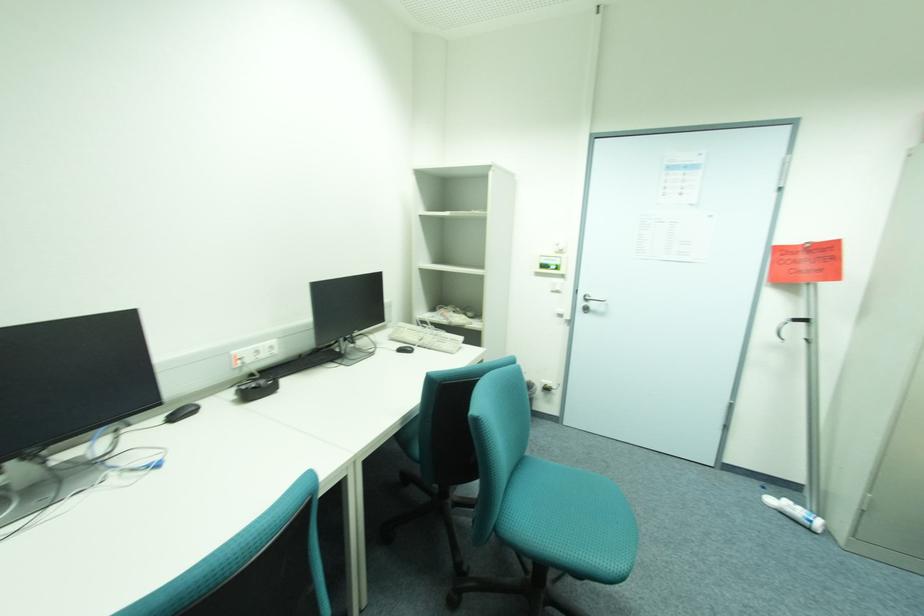
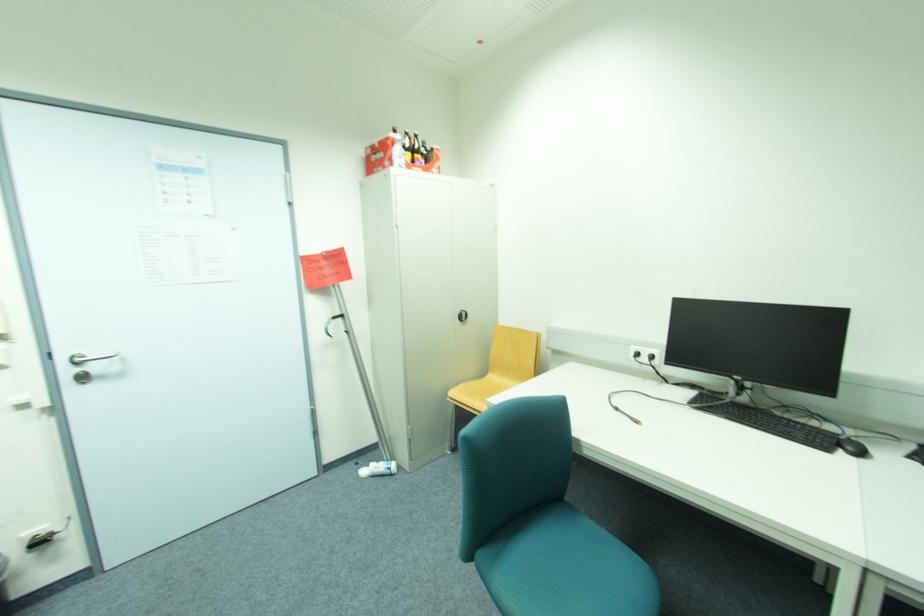
In the second image, find the point that corresponds to point (589, 304) in the first image.

(74, 371)